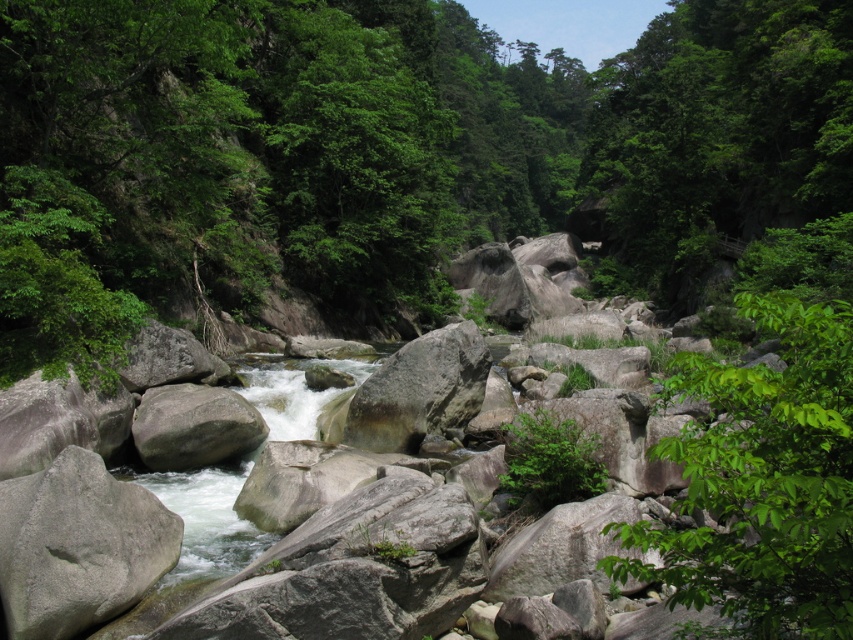
The image size is (853, 640). I want to click on gray rough boulder at lower left, so click(x=78, y=545).

Who is more forward, (80, 460) or (202, 451)?

Point (80, 460) is in front.

This screenshot has height=640, width=853. What are the coordinates of `gray rough boulder at lower left` in the screenshot? It's located at (78, 545).

In the scene shown: Can you confirm if gray rough boulder at lower left is positioned below gray rough boulder at center?

Correct, gray rough boulder at lower left is located below gray rough boulder at center.

Which is behind, point (3, 524) or point (445, 424)?

The point (445, 424) is behind.

This screenshot has width=853, height=640. Identify the location of gray rough boulder at lower left. (78, 545).

Between green leafy tree at center and gray rough boulder at center, which one has less height?

gray rough boulder at center is shorter.

Is point (778, 625) more distant than point (468, 400)?

No, (778, 625) is closer to viewer.

Is point (821, 424) positioned in front of point (477, 342)?

Yes, point (821, 424) is in front of point (477, 342).

Where is `green leafy tree at center`? green leafy tree at center is located at coordinates (764, 481).